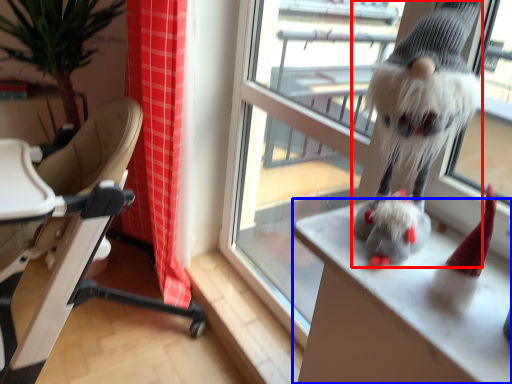
Question: Which point is closer to the camera, animal (highlighted by a red box) or desk (highlighted by a blue box)?

Choices:
 (A) animal
 (B) desk

Answer: (A)